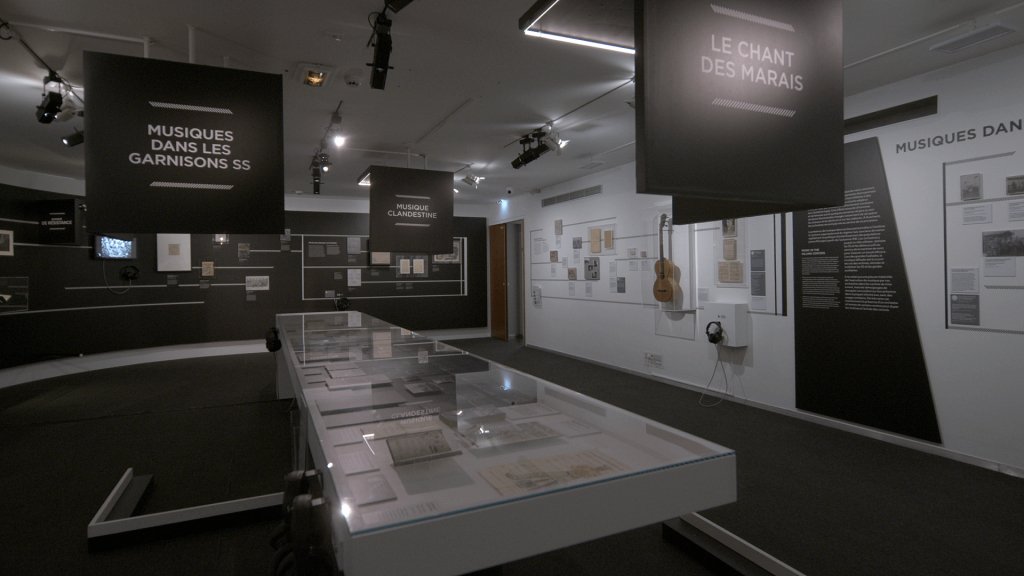
Locate an element on the screen. This screenshot has height=576, width=1024. walls is located at coordinates (177, 317), (787, 337).